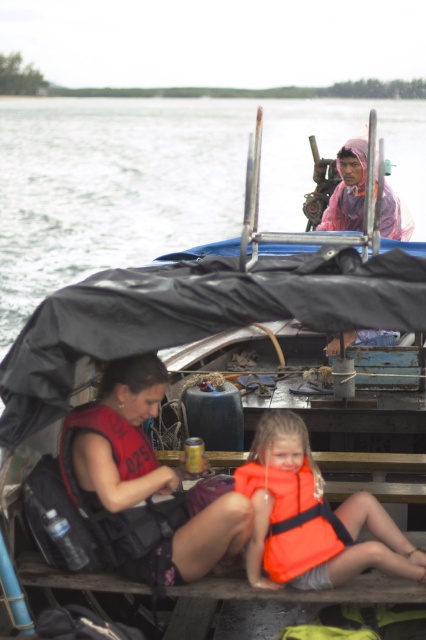
You are a safety inspector checking the boat for proper equipment. You notice two orange life vests at center. According to the boat safety regulations, life vests must be easily accessible and not stored under other items. Can you determine if the orange life vest at center meets this requirement based on its position relative to the orange fabric life jacket at center?

The orange life vest at center is located above the orange fabric life jacket at center, meaning it is not stored under another item and is easily accessible. Therefore, it meets the boat safety regulations.

You are a passenger on the boat and need to choose between the matte red life vest at lower left and the orange fabric life jacket at center. Which one is located to the left of the other?

The matte red life vest at lower left is positioned on the left side of orange fabric life jacket at center.

You are on a boat and need to quickly grab a life vest. Which one is easier to reach, the matte red life vest at lower left or the orange life vest at center?

The matte red life vest at lower left is closer to the viewer than the orange life vest at center, so it is easier to reach.